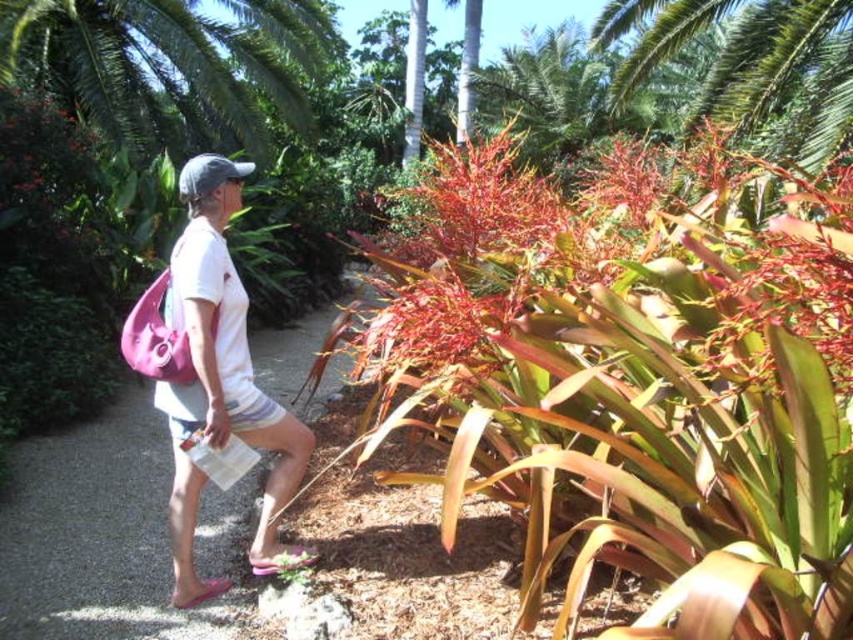
You are a photographer trying to capture a photo of the person walking along the path. Since the green leafy palm tree at upper center and the white fabric shirt at center are both in the frame, which one should you focus on to ensure it appears larger in the photo?

The green leafy palm tree at upper center is taller than the white fabric shirt at center, so focusing on it will make it appear larger in the photo.

You are a photographer trying to capture the person in the scene. You want to ensure both the pink fabric bag at left and the white fabric shirt at center are visible in your shot. Based on their positions, which object should you focus on first to frame the shot properly?

The pink fabric bag at left is to the left of the white fabric shirt at center, so you should focus on the white fabric shirt at center first to ensure both are in frame.